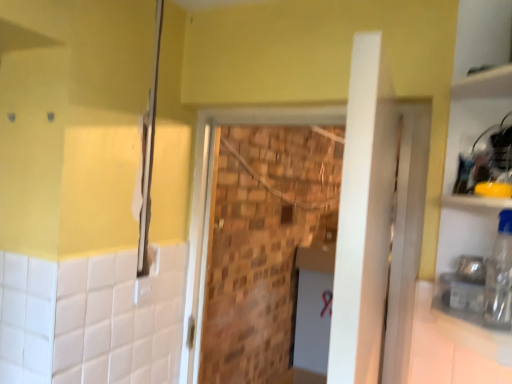
Question: Is the position of brick wall at center more distant than that of matte silver shower at left?

Choices:
 (A) no
 (B) yes

Answer: (A)

Question: From a real-world perspective, is brick wall at center under matte silver shower at left?

Choices:
 (A) yes
 (B) no

Answer: (A)

Question: Can you confirm if brick wall at center is taller than matte silver shower at left?

Choices:
 (A) no
 (B) yes

Answer: (B)

Question: Is brick wall at center outside of matte silver shower at left?

Choices:
 (A) no
 (B) yes

Answer: (B)

Question: Is brick wall at center positioned far away from matte silver shower at left?

Choices:
 (A) no
 (B) yes

Answer: (A)

Question: In the image, is matte silver shower at left positioned in front of or behind brick wall at center?

Choices:
 (A) behind
 (B) front

Answer: (A)

Question: Based on their positions, is matte silver shower at left located to the left or right of brick wall at center?

Choices:
 (A) left
 (B) right

Answer: (A)

Question: Does point (144, 216) appear closer or farther from the camera than point (375, 211)?

Choices:
 (A) closer
 (B) farther

Answer: (B)

Question: From the image's perspective, is matte silver shower at left positioned above or below brick wall at center?

Choices:
 (A) below
 (B) above

Answer: (B)

Question: Do you think white glossy counter top at lower right is within matte silver shower at left, or outside of it?

Choices:
 (A) inside
 (B) outside

Answer: (B)

Question: Considering the positions of white glossy counter top at lower right and matte silver shower at left in the image, is white glossy counter top at lower right taller or shorter than matte silver shower at left?

Choices:
 (A) tall
 (B) short

Answer: (B)

Question: Is white glossy counter top at lower right bigger or smaller than matte silver shower at left?

Choices:
 (A) small
 (B) big

Answer: (B)

Question: Would you say white glossy counter top at lower right is to the left or to the right of matte silver shower at left in the picture?

Choices:
 (A) left
 (B) right

Answer: (B)

Question: Considering the positions of white glossy counter top at lower right and transparent plastic bottle at right in the image, is white glossy counter top at lower right bigger or smaller than transparent plastic bottle at right?

Choices:
 (A) big
 (B) small

Answer: (A)

Question: Is white glossy counter top at lower right taller or shorter than transparent plastic bottle at right?

Choices:
 (A) tall
 (B) short

Answer: (B)